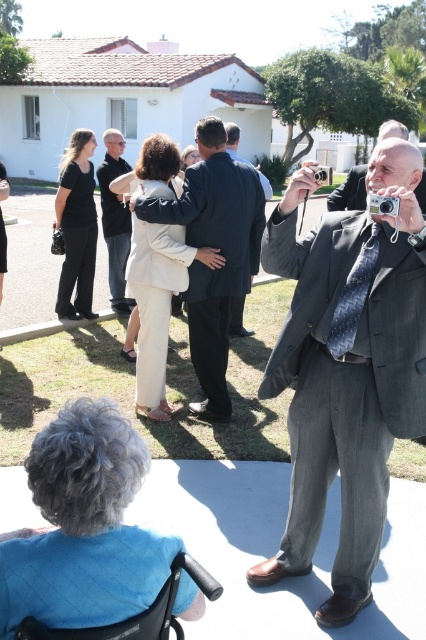
Question: Which point appears farthest from the camera in this image?

Choices:
 (A) (118, 284)
 (B) (382, 138)

Answer: (A)

Question: Can you confirm if dark gray suit at center is positioned below silver metallic camera at right?

Choices:
 (A) yes
 (B) no

Answer: (B)

Question: Which point is farther from the camera taking this photo?

Choices:
 (A) (327, 180)
 (B) (100, 448)
 (C) (100, 205)
 (D) (242, 332)

Answer: (C)

Question: Which object appears farthest from the camera in this image?

Choices:
 (A) gray suit at right
 (B) dark gray suit at center

Answer: (B)

Question: In this image, where is silver metallic camera at right located relative to silver metallic camera at upper right?

Choices:
 (A) below
 (B) above

Answer: (A)

Question: Does black matte pants at left appear on the left side of silver metallic camera at right?

Choices:
 (A) no
 (B) yes

Answer: (B)